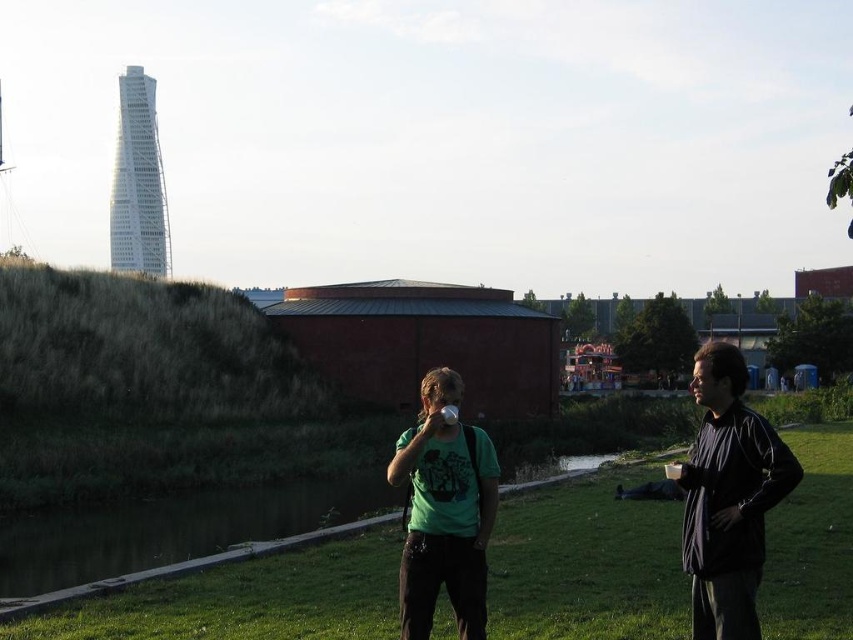
Is green grass at center smaller than green matte shirt at center?

No.

Is point (230, 611) more distant than point (479, 524)?

Yes, it is.

In order to click on green grass at center in this screenshot , I will do `click(587, 564)`.

Is green grass at center wider than green matte t-shirt at center?

Correct, the width of green grass at center exceeds that of green matte t-shirt at center.

Between green grass at center and green matte t-shirt at center, which one is positioned lower?

Positioned lower is green grass at center.

Which is behind, point (350, 577) or point (709, 360)?

The point (350, 577) is more distant.

The height and width of the screenshot is (640, 853). Identify the location of green grass at center. (587, 564).

Between green matte t-shirt at center and black matte jacket at right, which one appears on the right side from the viewer's perspective?

green matte t-shirt at center

What do you see at coordinates (728, 497) in the screenshot? I see `green matte t-shirt at center` at bounding box center [728, 497].

Locate an element on the screen. The height and width of the screenshot is (640, 853). green matte t-shirt at center is located at coordinates (728, 497).